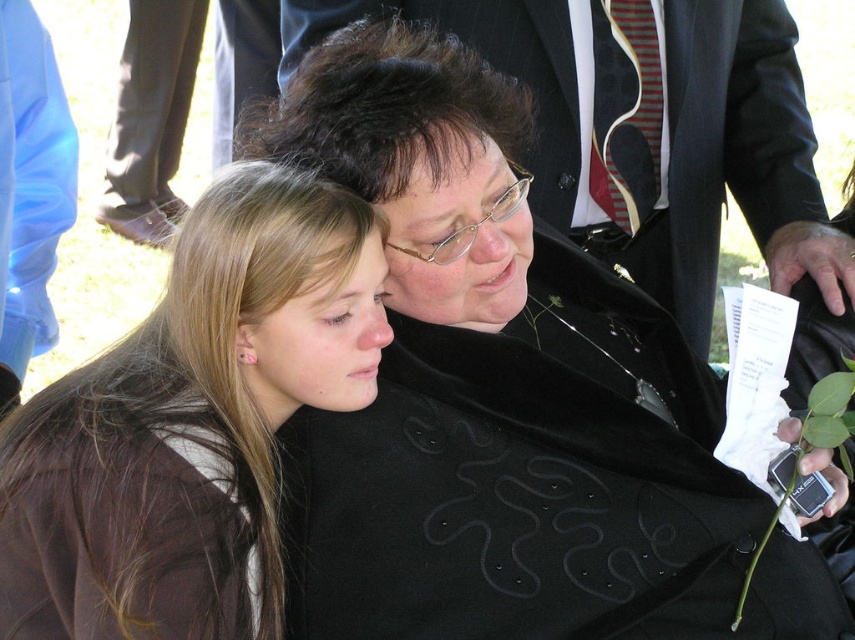
You are a photographer at a formal event and need to capture a closeup shot of both the matte black coat at center and the dark brown silky hair at center. The camera you are using has a minimum focusing distance of 50 centimeters. Can you take the photo without moving either object?

The matte black coat at center is only 48.85 centimeters away from the dark brown silky hair at center, which is less than the camera minimum focusing distance of 50 centimeters. Therefore, you cannot take the photo without moving either object closer or further apart.

You are attending a memorial service and notice two people in the scene. The person with brown hair at left and the person with matte black coat at center. Which individual is closer to the front of the gathering?

The brown hair at left is in front of matte black coat at center, so the person with brown hair at left is closer to the front of the gathering.